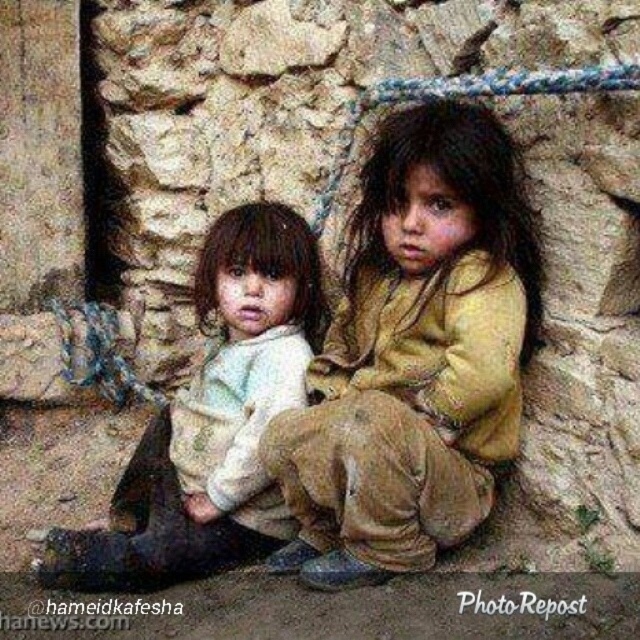
Is brown textured cloth at center positioned in front of white soft fabric at center?

Yes, it is.

Can you confirm if brown textured cloth at center is taller than white soft fabric at center?

Indeed, brown textured cloth at center has a greater height compared to white soft fabric at center.

Is point (394, 118) farther from viewer compared to point (140, 486)?

No, (394, 118) is in front of (140, 486).

Find the location of `brown textured cloth at center`. brown textured cloth at center is located at coordinates (413, 355).